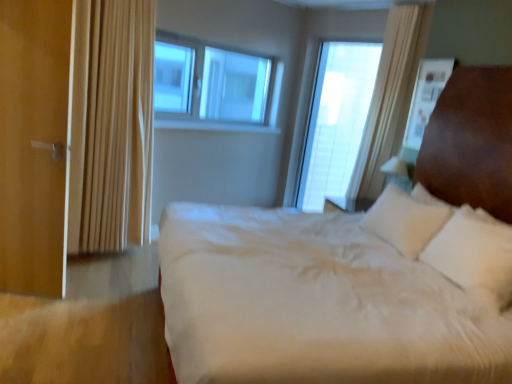
Question: In the image, is transparent glass window at center, which ranks as the first window in left-to-right order, positioned in front of or behind white soft bed at center?

Choices:
 (A) front
 (B) behind

Answer: (B)

Question: Based on their sizes in the image, would you say transparent glass window at center, arranged as the 2th window when viewed from the right, is bigger or smaller than white soft bed at center?

Choices:
 (A) small
 (B) big

Answer: (A)

Question: Which object is the farthest from the transparent glass window at center, placed as the first window when sorted from right to left?

Choices:
 (A) white soft bed at center
 (B) transparent glass window at center, which ranks as the first window in left-to-right order
 (C) matte wood door at left
 (D) beige fabric curtain at left

Answer: (C)

Question: Considering the real-world distances, which object is closest to the transparent glass window at center, which ranks as the first window in left-to-right order?

Choices:
 (A) matte wood door at left
 (B) beige fabric curtain at left
 (C) transparent glass window at center, placed as the first window when sorted from right to left
 (D) white soft bed at center

Answer: (B)